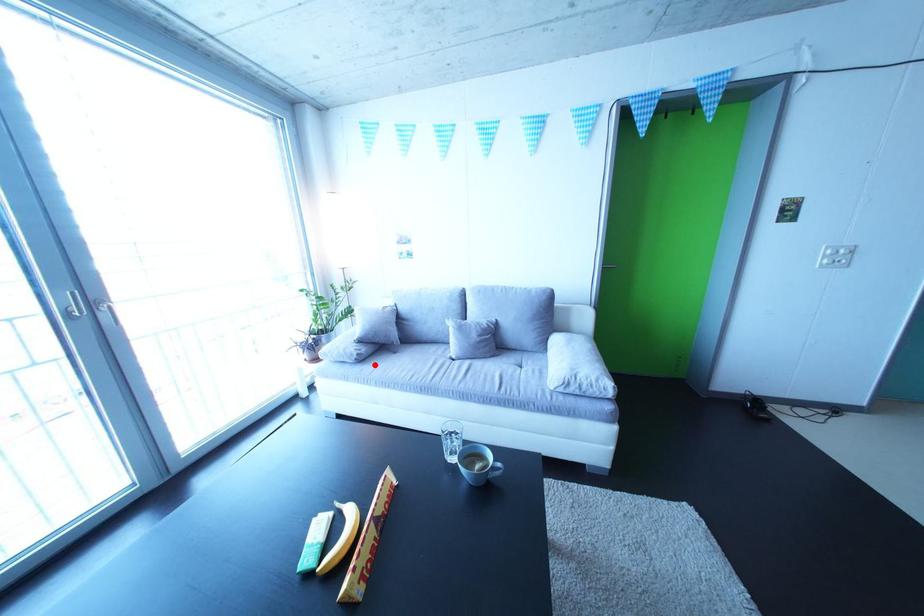
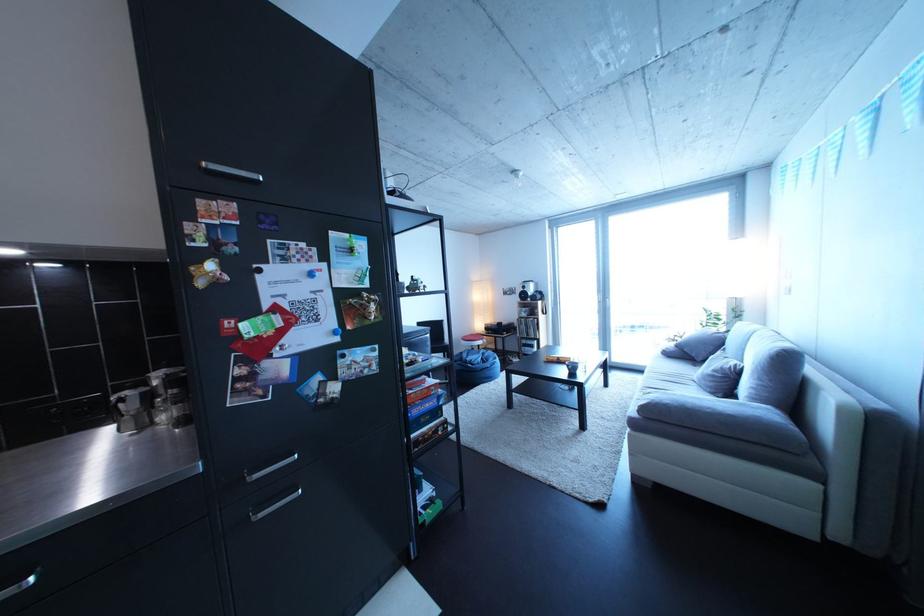
Locate, in the second image, the point that corresponds to the highlighted location in the first image.

(682, 361)